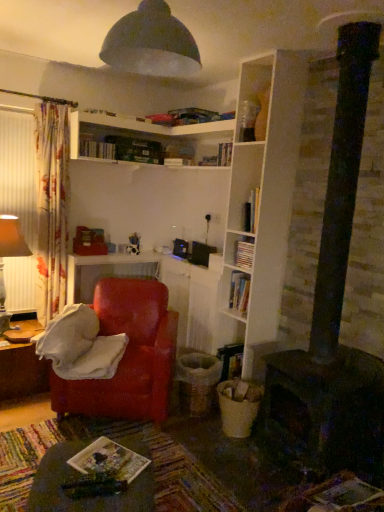
Question: From a real-world perspective, is white matte bookshelf at center, the 2th book viewed from the top, positioned under white wooden shelves at upper center based on gravity?

Choices:
 (A) no
 (B) yes

Answer: (B)

Question: Is white matte bookshelf at center, which ranks as the 1th book in right-to-left order, outside of white wooden shelves at upper center?

Choices:
 (A) yes
 (B) no

Answer: (A)

Question: Is white matte bookshelf at center, which ranks as the 1th book in right-to-left order, positioned before white wooden shelves at upper center?

Choices:
 (A) no
 (B) yes

Answer: (B)

Question: Does white matte bookshelf at center, placed as the 3th book when sorted from left to right, have a smaller size compared to white wooden shelves at upper center?

Choices:
 (A) no
 (B) yes

Answer: (B)

Question: Is there a large distance between white matte bookshelf at center, which ranks as the 1th book in right-to-left order, and white wooden shelves at upper center?

Choices:
 (A) yes
 (B) no

Answer: (A)

Question: In terms of width, does matte red armchair at left look wider or thinner when compared to white matte bookshelf at center, which ranks as the 1th book in right-to-left order?

Choices:
 (A) wide
 (B) thin

Answer: (A)

Question: Is point (99, 292) positioned closer to the camera than point (238, 256)?

Choices:
 (A) closer
 (B) farther

Answer: (B)

Question: Do you think matte red armchair at left is within white matte bookshelf at center, which ranks as the 1th book in right-to-left order, or outside of it?

Choices:
 (A) inside
 (B) outside

Answer: (B)

Question: Is matte red armchair at left taller or shorter than white matte bookshelf at center, the 2th book viewed from the top?

Choices:
 (A) short
 (B) tall

Answer: (B)

Question: Is matte red armchair at left inside the boundaries of black matte fireplace at lower right, or outside?

Choices:
 (A) outside
 (B) inside

Answer: (A)

Question: In the image, is matte red armchair at left positioned in front of or behind black matte fireplace at lower right?

Choices:
 (A) front
 (B) behind

Answer: (B)

Question: Is matte red armchair at left bigger or smaller than black matte fireplace at lower right?

Choices:
 (A) big
 (B) small

Answer: (A)

Question: Would you say matte red armchair at left is to the left or to the right of black matte fireplace at lower right in the picture?

Choices:
 (A) right
 (B) left

Answer: (B)

Question: From a real-world perspective, is wooden board game at lower center, acting as the first book starting from the bottom, positioned above or below black matte fireplace at lower right?

Choices:
 (A) below
 (B) above

Answer: (B)

Question: In the image, is wooden board game at lower center, acting as the first book starting from the bottom, on the left side or the right side of black matte fireplace at lower right?

Choices:
 (A) right
 (B) left

Answer: (B)